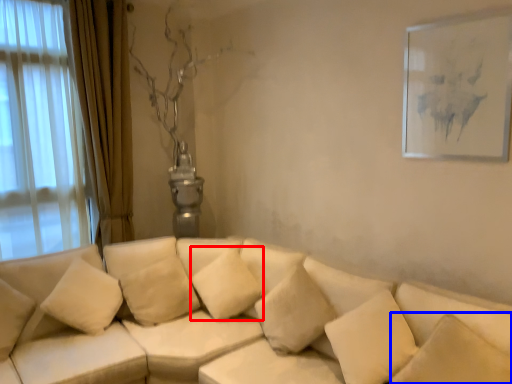
Question: Which of the following is the closest to the observer, pillow (highlighted by a red box) or pillow (highlighted by a blue box)?

Choices:
 (A) pillow
 (B) pillow

Answer: (B)